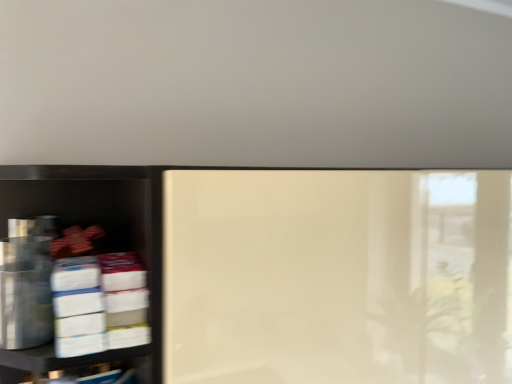
Question: From a real-world perspective, is metallic silver canisters at left, which is counted as the 1th shelf, starting from the left, on top of matte white shelf at center, the second shelf positioned from the left?

Choices:
 (A) yes
 (B) no

Answer: (A)

Question: Does metallic silver canisters at left, marked as the second shelf in a right-to-left arrangement, appear on the left side of matte white shelf at center, the second shelf positioned from the left?

Choices:
 (A) yes
 (B) no

Answer: (A)

Question: Is metallic silver canisters at left, marked as the second shelf in a right-to-left arrangement, further to the viewer compared to matte white shelf at center, which is the first shelf in right-to-left order?

Choices:
 (A) no
 (B) yes

Answer: (A)

Question: Is metallic silver canisters at left, marked as the second shelf in a right-to-left arrangement, in contact with matte white shelf at center, the second shelf positioned from the left?

Choices:
 (A) yes
 (B) no

Answer: (B)

Question: Can you confirm if metallic silver canisters at left, which is counted as the 1th shelf, starting from the left, is smaller than matte white shelf at center, the second shelf positioned from the left?

Choices:
 (A) no
 (B) yes

Answer: (B)

Question: Is metallic silver canisters at left, marked as the second shelf in a right-to-left arrangement, thinner than matte white shelf at center, which is the first shelf in right-to-left order?

Choices:
 (A) yes
 (B) no

Answer: (A)

Question: From the image's perspective, does matte white shelf at center, the second shelf positioned from the left, appear higher than metallic silver canisters at left, marked as the second shelf in a right-to-left arrangement?

Choices:
 (A) no
 (B) yes

Answer: (A)

Question: Does matte white shelf at center, which is the first shelf in right-to-left order, turn towards metallic silver canisters at left, which is counted as the 1th shelf, starting from the left?

Choices:
 (A) no
 (B) yes

Answer: (A)

Question: Considering the relative positions of matte white shelf at center, which is the first shelf in right-to-left order, and metallic silver canisters at left, marked as the second shelf in a right-to-left arrangement, in the image provided, is matte white shelf at center, which is the first shelf in right-to-left order, to the left of metallic silver canisters at left, marked as the second shelf in a right-to-left arrangement, from the viewer's perspective?

Choices:
 (A) no
 (B) yes

Answer: (A)

Question: From a real-world perspective, is matte white shelf at center, which is the first shelf in right-to-left order, on metallic silver canisters at left, which is counted as the 1th shelf, starting from the left?

Choices:
 (A) no
 (B) yes

Answer: (A)

Question: Is metallic silver canisters at left, marked as the second shelf in a right-to-left arrangement, surrounded by matte white shelf at center, which is the first shelf in right-to-left order?

Choices:
 (A) yes
 (B) no

Answer: (B)

Question: Considering the relative positions of matte white shelf at center, which is the first shelf in right-to-left order, and metallic silver canisters at left, marked as the second shelf in a right-to-left arrangement, in the image provided, is matte white shelf at center, which is the first shelf in right-to-left order, in front of metallic silver canisters at left, marked as the second shelf in a right-to-left arrangement,?

Choices:
 (A) yes
 (B) no

Answer: (B)

Question: Based on their positions, is matte white shelf at center, the second shelf positioned from the left, located to the left or right of metallic silver canisters at left, marked as the second shelf in a right-to-left arrangement?

Choices:
 (A) left
 (B) right

Answer: (B)